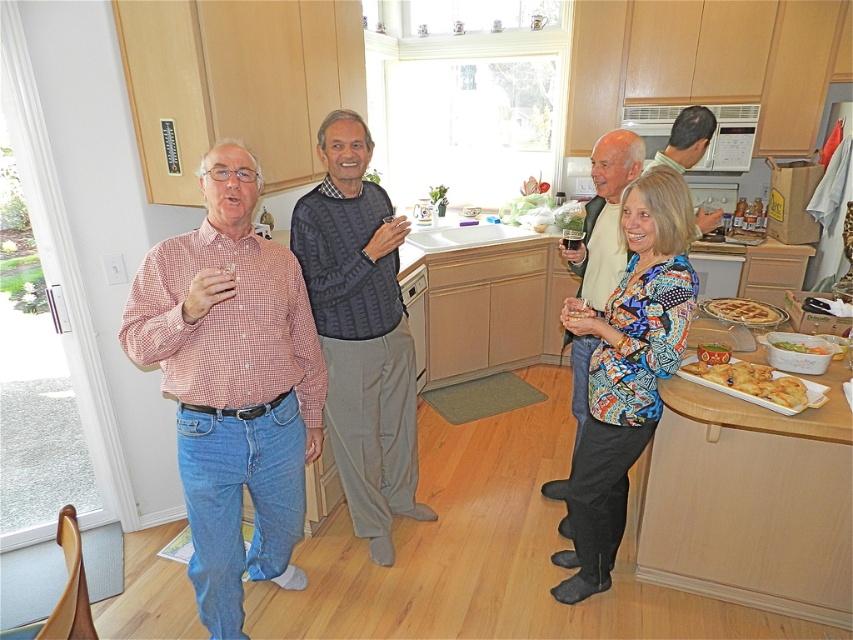
Image resolution: width=853 pixels, height=640 pixels. What are the coordinates of `knitted sweater at center` in the screenshot? It's located at (361, 332).

Between point (339, 330) and point (752, 396), which one is positioned behind?

The point (339, 330) is more distant.

Where is `knitted sweater at center`? The height and width of the screenshot is (640, 853). knitted sweater at center is located at coordinates (361, 332).

Is golden crispy waffle at center further to the viewer compared to green leafy salad at lower right?

Yes, it is.

Does golden crispy waffle at center appear on the left side of green leafy salad at lower right?

In fact, golden crispy waffle at center is to the right of green leafy salad at lower right.

This screenshot has height=640, width=853. What do you see at coordinates (741, 310) in the screenshot?
I see `golden crispy waffle at center` at bounding box center [741, 310].

I want to click on golden crispy waffle at center, so click(741, 310).

Who is more forward, (601, 460) or (608, 180)?

Point (601, 460) is in front.

Can you confirm if printed fabric blouse at center is thinner than gray sweater at center?

In fact, printed fabric blouse at center might be wider than gray sweater at center.

The image size is (853, 640). I want to click on printed fabric blouse at center, so click(x=625, y=371).